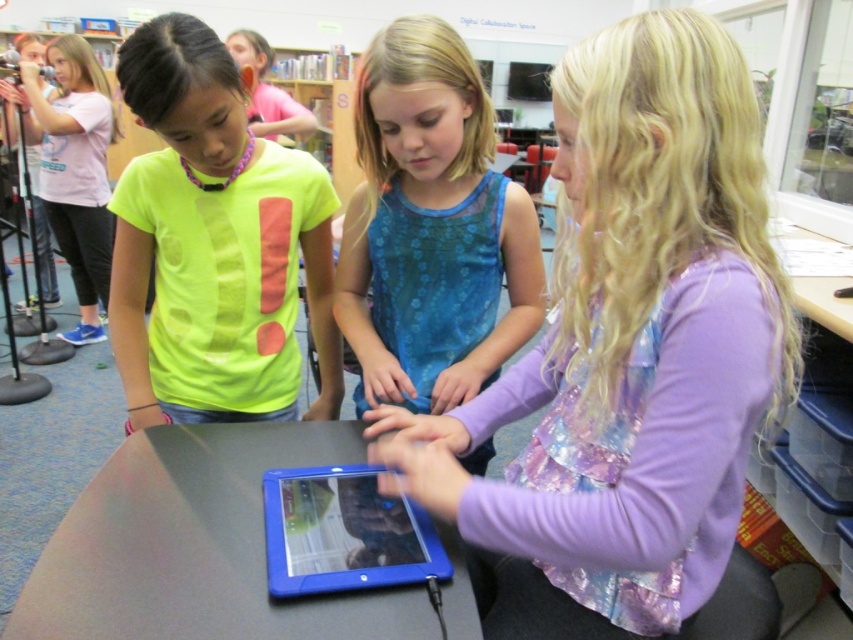
You are standing 4 feet away from the camera. Is the point at coordinates point (157, 129) within your reach without moving your feet?

The distance of point (157, 129) from camera is 3.80 feet. Since you are 4 feet away from the camera, the point is 0.2 feet closer to the camera than your position. Therefore, you can reach the point at coordinates point 0.202, 0.285 without moving your feet.